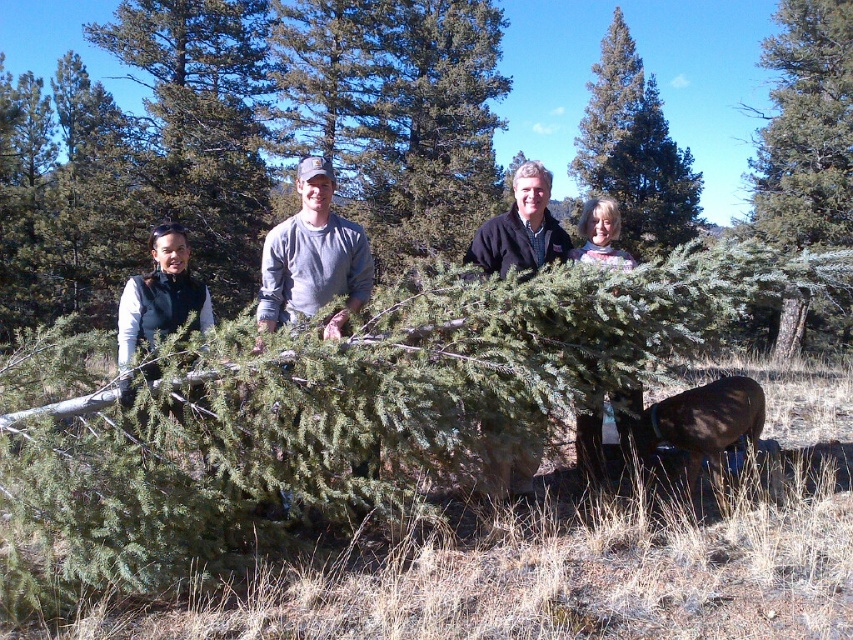
Question: Which object appears farthest from the camera in this image?

Choices:
 (A) green leafy tree at center
 (B) black fleece jacket at center

Answer: (B)

Question: Which point appears closest to the camera in this image?

Choices:
 (A) (310, 298)
 (B) (544, 198)

Answer: (A)

Question: Is the position of green leafy tree at center more distant than that of gray cotton shirt at center?

Choices:
 (A) yes
 (B) no

Answer: (A)

Question: From the image, what is the correct spatial relationship of green leafy tree at center in relation to black fleece jacket at center?

Choices:
 (A) left
 (B) right

Answer: (B)

Question: Which object is farther from the camera taking this photo?

Choices:
 (A) gray cotton shirt at center
 (B) black fleece jacket at center
 (C) green leafy tree at center

Answer: (B)

Question: Does green leafy tree at center have a greater width compared to black fleece jacket at center?

Choices:
 (A) no
 (B) yes

Answer: (B)